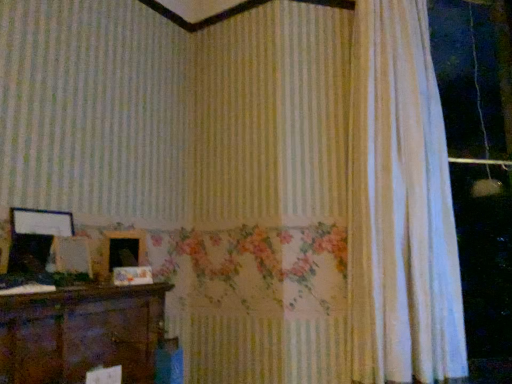
Question: Is wooden picture frame at left, acting as the 1th picture frame starting from the left, not within wooden picture frame at center, the 1th picture frame from the right?

Choices:
 (A) no
 (B) yes

Answer: (B)

Question: Is wooden picture frame at left, acting as the 1th picture frame starting from the left, next to wooden picture frame at center, the 1th picture frame from the right?

Choices:
 (A) yes
 (B) no

Answer: (B)

Question: Can you confirm if wooden picture frame at left, acting as the 1th picture frame starting from the left, is bigger than wooden picture frame at center, the 1th picture frame from the right?

Choices:
 (A) yes
 (B) no

Answer: (B)

Question: Is wooden picture frame at left, acting as the 1th picture frame starting from the left, at the left side of wooden picture frame at center, positioned as the 2th picture frame in left-to-right order?

Choices:
 (A) no
 (B) yes

Answer: (B)

Question: From the image's perspective, does wooden picture frame at left, acting as the 1th picture frame starting from the left, appear higher than wooden picture frame at center, the 1th picture frame from the right?

Choices:
 (A) no
 (B) yes

Answer: (B)

Question: From the image's perspective, is white sheer curtain at right located above or below wooden picture frame at left, acting as the 1th picture frame starting from the left?

Choices:
 (A) above
 (B) below

Answer: (A)

Question: Choose the correct answer: Is white sheer curtain at right inside wooden picture frame at left, which appears as the 2th picture frame when viewed from the right, or outside it?

Choices:
 (A) inside
 (B) outside

Answer: (B)

Question: Does point (449, 236) appear closer or farther from the camera than point (66, 228)?

Choices:
 (A) farther
 (B) closer

Answer: (A)

Question: In the image, is white sheer curtain at right on the left side or the right side of wooden picture frame at left, which appears as the 2th picture frame when viewed from the right?

Choices:
 (A) right
 (B) left

Answer: (A)

Question: Is wooden picture frame at center, the 1th picture frame from the right, spatially inside white sheer curtain at right, or outside of it?

Choices:
 (A) outside
 (B) inside

Answer: (A)

Question: Is wooden picture frame at center, positioned as the 2th picture frame in left-to-right order, in front of or behind white sheer curtain at right in the image?

Choices:
 (A) behind
 (B) front

Answer: (B)

Question: Is point (137, 240) closer or farther from the camera than point (419, 226)?

Choices:
 (A) closer
 (B) farther

Answer: (A)

Question: Considering the relative positions of wooden picture frame at center, the 1th picture frame from the right, and white sheer curtain at right in the image provided, is wooden picture frame at center, the 1th picture frame from the right, to the left or to the right of white sheer curtain at right?

Choices:
 (A) right
 (B) left

Answer: (B)

Question: In the image, is wooden picture frame at center, positioned as the 2th picture frame in left-to-right order, on the left side or the right side of wooden picture frame at left, acting as the 1th picture frame starting from the left?

Choices:
 (A) right
 (B) left

Answer: (A)

Question: In terms of width, does wooden picture frame at center, the 1th picture frame from the right, look wider or thinner when compared to wooden picture frame at left, which appears as the 2th picture frame when viewed from the right?

Choices:
 (A) wide
 (B) thin

Answer: (A)